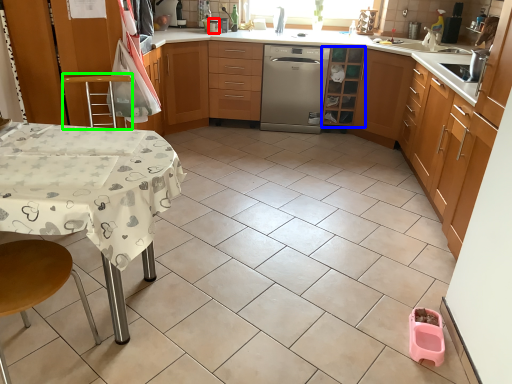
Question: Based on their relative distances, which object is nearer to appliance (highlighted by a red box)? Choose from cabinetry (highlighted by a blue box) and step stool (highlighted by a green box).

Choices:
 (A) cabinetry
 (B) step stool

Answer: (A)